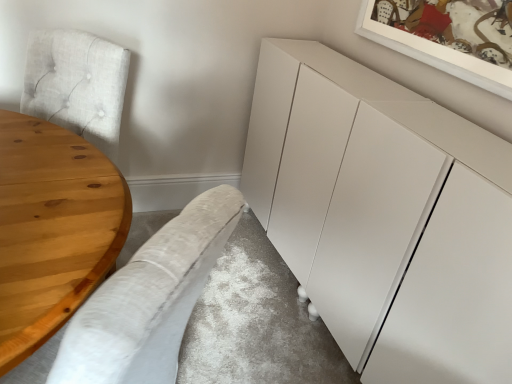
In order to face white matte cabinet at center, should I rotate leftwards or rightwards?

To align with it, rotate right about 13.154°.

Describe the element at coordinates (52, 229) in the screenshot. This screenshot has height=384, width=512. I see `natural wood table at left` at that location.

Find the location of a particular element. The image size is (512, 384). white matte cabinet at center is located at coordinates (384, 216).

Who is bigger, natural wood table at left or light gray fabric couch at lower left?

natural wood table at left.

Who is shorter, natural wood table at left or light gray fabric couch at lower left?

Standing shorter between the two is natural wood table at left.

Is point (31, 267) farther from camera compared to point (226, 230)?

Yes, it is behind point (226, 230).

How many degrees apart are the facing directions of natural wood table at left and light gray fabric couch at lower left?

The angle between the facing direction of natural wood table at left and the facing direction of light gray fabric couch at lower left is 35.7 degrees.

Considering the sizes of objects white matte cabinet at center and natural wood table at left in the image provided, who is bigger, white matte cabinet at center or natural wood table at left?

white matte cabinet at center is bigger.

Which of these two, white matte cabinet at center or natural wood table at left, is wider?

natural wood table at left.

Considering the relative sizes of white matte cabinet at center and natural wood table at left in the image provided, is white matte cabinet at center taller than natural wood table at left?

Yes.

Is white matte cabinet at center facing away from light gray fabric couch at lower left?

No, white matte cabinet at center is not facing the opposite direction of light gray fabric couch at lower left.

Can you confirm if white matte cabinet at center is shorter than light gray fabric couch at lower left?

Indeed, white matte cabinet at center has a lesser height compared to light gray fabric couch at lower left.

In the image, is white matte cabinet at center positioned in front of or behind light gray fabric couch at lower left?

In the image, white matte cabinet at center appears behind light gray fabric couch at lower left.

How far apart are white matte cabinet at center and light gray fabric couch at lower left?

A distance of 30.28 inches exists between white matte cabinet at center and light gray fabric couch at lower left.

Looking at this image, is natural wood table at left oriented away from white matte cabinet at center?

Absolutely, natural wood table at left is directed away from white matte cabinet at center.

Is natural wood table at left next to white matte cabinet at center?

No.

From a real-world perspective, between natural wood table at left and white matte cabinet at center, who is vertically lower?

From a 3D spatial view, natural wood table at left is below.

Considering the relative sizes of natural wood table at left and white matte cabinet at center in the image provided, is natural wood table at left bigger than white matte cabinet at center?

No, natural wood table at left is not bigger than white matte cabinet at center.

Is light gray fabric couch at lower left shorter than natural wood table at left?

No.

Would you say light gray fabric couch at lower left is to the left or to the right of natural wood table at left in the picture?

From the image, it's evident that light gray fabric couch at lower left is to the right of natural wood table at left.

Is light gray fabric couch at lower left positioned beyond the bounds of natural wood table at left?

Actually, light gray fabric couch at lower left is within natural wood table at left.

From the picture: Which is farther from the camera, (81, 330) or (456, 355)?

The point (456, 355) is behind.

Is light gray fabric couch at lower left located outside white matte cabinet at center?

Yes, light gray fabric couch at lower left is outside of white matte cabinet at center.

Looking at this image, is light gray fabric couch at lower left positioned with its back to white matte cabinet at center?

No, light gray fabric couch at lower left is not facing the opposite direction of white matte cabinet at center.

Considering the sizes of objects light gray fabric couch at lower left and white matte cabinet at center in the image provided, who is wider, light gray fabric couch at lower left or white matte cabinet at center?

light gray fabric couch at lower left.

This screenshot has height=384, width=512. In order to click on table lying above the light gray fabric couch at lower left (from the image's perspective) in this screenshot , I will do `click(52, 229)`.

Identify the location of cabinetry behind the natural wood table at left. (384, 216).

Based on the photo, considering their positions, is natural wood table at left positioned closer to light gray fabric couch at lower left than white matte cabinet at center?

Among the two, natural wood table at left is located nearer to light gray fabric couch at lower left.

Based on the photo, which object lies further to the anchor point light gray fabric couch at lower left, white matte cabinet at center or natural wood table at left?

Based on the image, white matte cabinet at center appears to be further to light gray fabric couch at lower left.

When comparing their distances from natural wood table at left, does light gray fabric couch at lower left or white matte cabinet at center seem further?

white matte cabinet at center is further to natural wood table at left.

Looking at the image, which one is located closer to white matte cabinet at center, light gray fabric couch at lower left or natural wood table at left?

light gray fabric couch at lower left is positioned closer to the anchor white matte cabinet at center.

Estimate the real-world distances between objects in this image. Which object is further from natural wood table at left, white matte cabinet at center or light gray fabric couch at lower left?

white matte cabinet at center is positioned further to the anchor natural wood table at left.

Estimate the real-world distances between objects in this image. Which object is further from white matte cabinet at center, natural wood table at left or light gray fabric couch at lower left?

natural wood table at left lies further to white matte cabinet at center than the other object.

The height and width of the screenshot is (384, 512). Identify the location of couch between natural wood table at left and white matte cabinet at center in the horizontal direction. (149, 299).